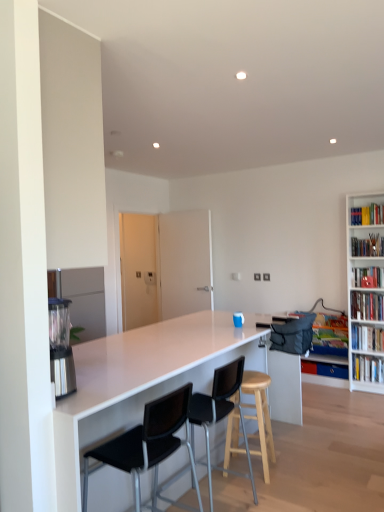
I want to click on empty space that is ontop of hardcover book at center, placed as the first book when sorted from bottom to top (from a real-world perspective), so click(x=327, y=360).